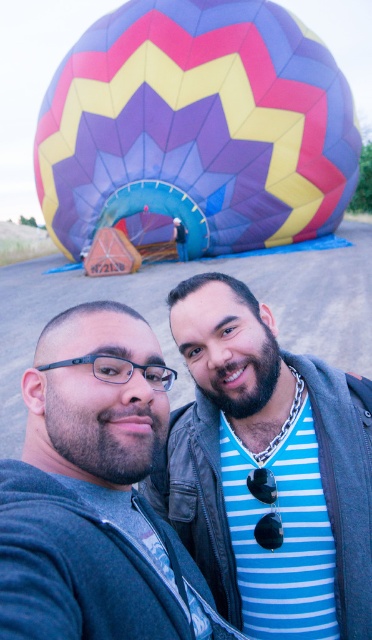
Question: Does multicolored fabric balloon at upper center have a larger size compared to matte black jacket at center?

Choices:
 (A) no
 (B) yes

Answer: (B)

Question: Is multicolored fabric balloon at upper center closer to camera compared to matte black jacket at center?

Choices:
 (A) yes
 (B) no

Answer: (B)

Question: Among these points, which one is nearest to the camera?

Choices:
 (A) (177, 448)
 (B) (75, 243)

Answer: (A)

Question: Among these points, which one is nearest to the camera?

Choices:
 (A) (226, 342)
 (B) (225, 131)

Answer: (A)

Question: Does multicolored fabric balloon at upper center have a lesser width compared to matte black jacket at center?

Choices:
 (A) no
 (B) yes

Answer: (A)

Question: Which of the following is the closest to the observer?

Choices:
 (A) matte black jacket at center
 (B) multicolored fabric balloon at upper center

Answer: (A)